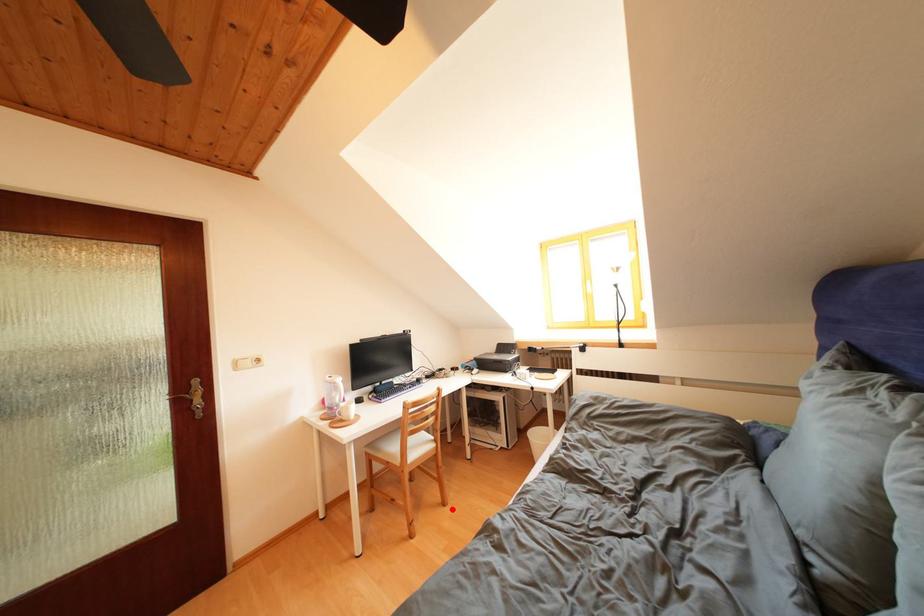
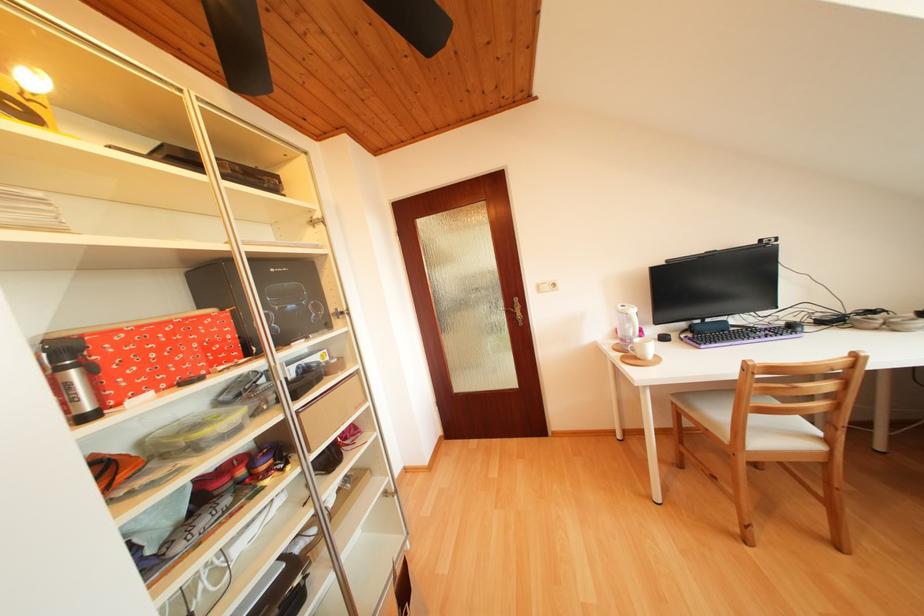
Locate, in the second image, the point that corresponds to the highlighted location in the first image.

(847, 553)